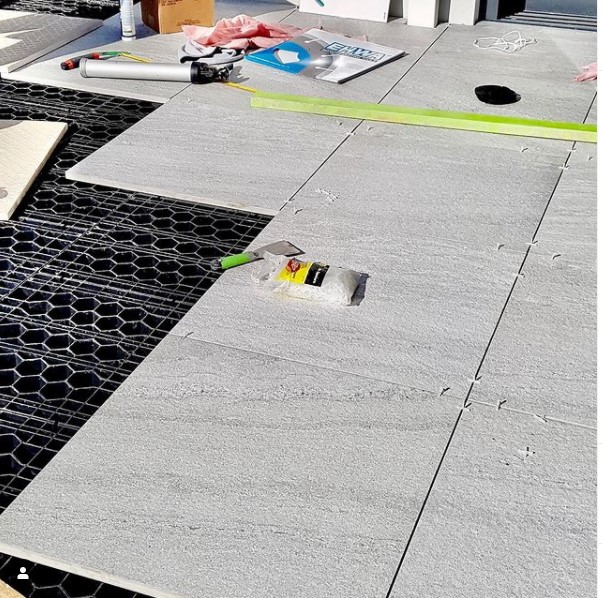
I want to click on tile, so click(236, 147).